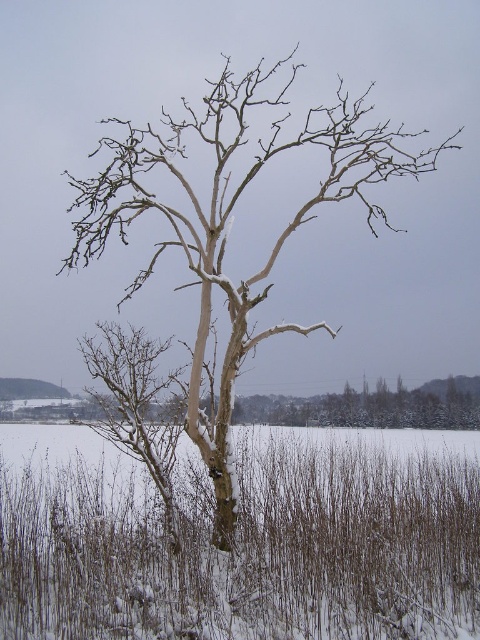
Can you confirm if snowy grass at center is bigger than snow-covered bark tree at center?

Correct, snowy grass at center is larger in size than snow-covered bark tree at center.

Which is in front, point (39, 609) or point (349, 164)?

Point (39, 609)

I want to click on snowy grass at center, so click(242, 538).